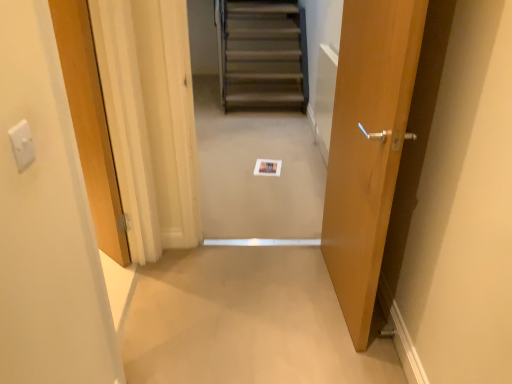
At what (x,y) coordinates should I click in order to perform the action: click on free space above beige carpet at center (from a real-world perspective). Please return your answer as a coordinate pair (x, y). Looking at the image, I should click on (240, 304).